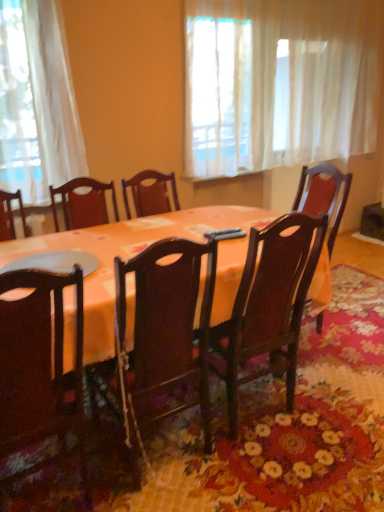
Question: Is wooden chair at center, which ranks as the 1th chair in right-to-left order, thinner than black plastic remote control at center?

Choices:
 (A) no
 (B) yes

Answer: (A)

Question: Considering the relative sizes of wooden chair at center, positioned as the second chair in left-to-right order, and black plastic remote control at center in the image provided, is wooden chair at center, positioned as the second chair in left-to-right order, shorter than black plastic remote control at center?

Choices:
 (A) yes
 (B) no

Answer: (B)

Question: Does wooden chair at center, positioned as the second chair in left-to-right order, have a greater height compared to black plastic remote control at center?

Choices:
 (A) yes
 (B) no

Answer: (A)

Question: From a real-world perspective, is wooden chair at center, which ranks as the 1th chair in right-to-left order, below black plastic remote control at center?

Choices:
 (A) no
 (B) yes

Answer: (B)

Question: Would you consider wooden chair at center, positioned as the second chair in left-to-right order, to be distant from black plastic remote control at center?

Choices:
 (A) yes
 (B) no

Answer: (B)

Question: Could you tell me if wooden chair at center, positioned as the second chair in left-to-right order, is facing black plastic remote control at center?

Choices:
 (A) no
 (B) yes

Answer: (B)

Question: Is matte dark wood chair at lower left, the second chair in the right-to-left sequence, far from black plastic remote control at center?

Choices:
 (A) no
 (B) yes

Answer: (A)

Question: Is the surface of matte dark wood chair at lower left, the second chair in the right-to-left sequence, in direct contact with black plastic remote control at center?

Choices:
 (A) yes
 (B) no

Answer: (B)

Question: From the image's perspective, is matte dark wood chair at lower left, the 1th chair viewed from the left, over black plastic remote control at center?

Choices:
 (A) no
 (B) yes

Answer: (A)

Question: Can you confirm if matte dark wood chair at lower left, the second chair in the right-to-left sequence, is positioned to the left of black plastic remote control at center?

Choices:
 (A) yes
 (B) no

Answer: (A)

Question: Is matte dark wood chair at lower left, the second chair in the right-to-left sequence, not inside black plastic remote control at center?

Choices:
 (A) yes
 (B) no

Answer: (A)

Question: Can you confirm if matte dark wood chair at lower left, the second chair in the right-to-left sequence, is shorter than black plastic remote control at center?

Choices:
 (A) no
 (B) yes

Answer: (A)

Question: Considering the relative sizes of white sheer curtain at upper center and orange fabric table at center in the image provided, is white sheer curtain at upper center wider than orange fabric table at center?

Choices:
 (A) no
 (B) yes

Answer: (A)